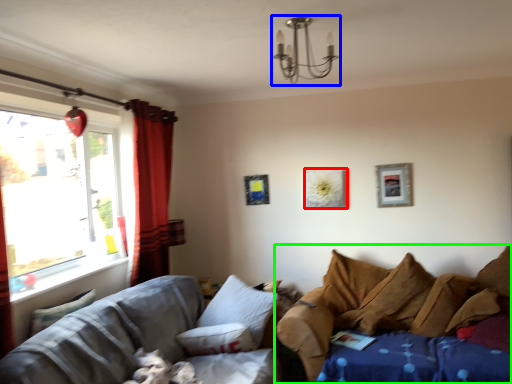
Question: Which object is positioned farthest from picture frame (highlighted by a red box)? Select from light fixture (highlighted by a blue box) and studio couch (highlighted by a green box).

Choices:
 (A) light fixture
 (B) studio couch

Answer: (A)